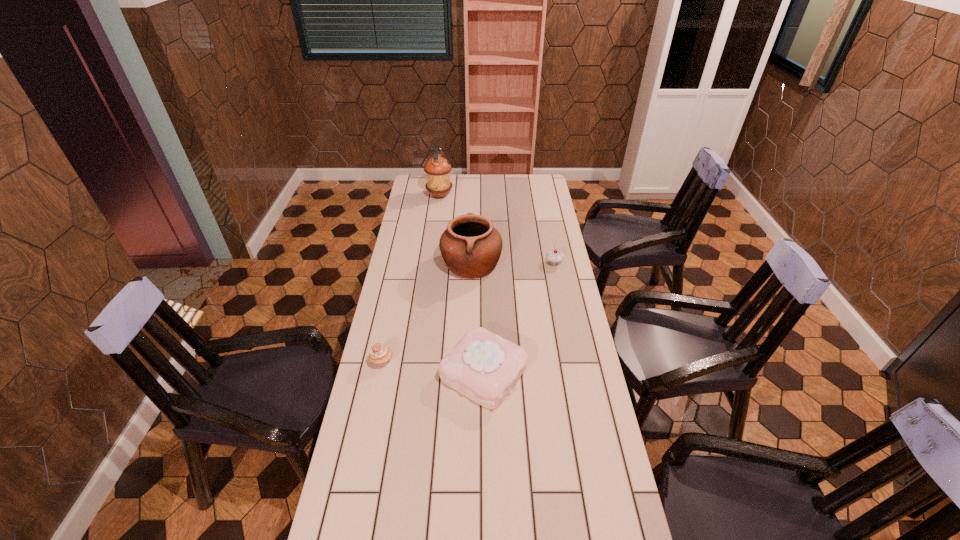
The height and width of the screenshot is (540, 960). Identify the location of oil lamp. (437, 168).

Image resolution: width=960 pixels, height=540 pixels. Identify the location of the farthest object. (437, 168).

This screenshot has width=960, height=540. Find the location of `the second tallest object`. the second tallest object is located at coordinates (471, 247).

Identify the location of the farther cupcake. This screenshot has height=540, width=960. (554, 257).

At what (x,y) coordinates should I click in order to perform the action: click on the taller cupcake. Please return your answer as a coordinate pair (x, y). This screenshot has width=960, height=540. Looking at the image, I should click on (554, 257).

This screenshot has width=960, height=540. What are the coordinates of `cake` in the screenshot? It's located at (484, 367).

Locate an element on the screen. Image resolution: width=960 pixels, height=540 pixels. the shorter cupcake is located at coordinates (380, 355).

Where is `the nearer cupcake`? the nearer cupcake is located at coordinates (380, 355).

Locate an element on the screen. vacant space located 0.150m on the front of the tallest object is located at coordinates (437, 219).

Image resolution: width=960 pixels, height=540 pixels. Find the location of `vacant space located on the left of the fourth shortest object`. vacant space located on the left of the fourth shortest object is located at coordinates (420, 265).